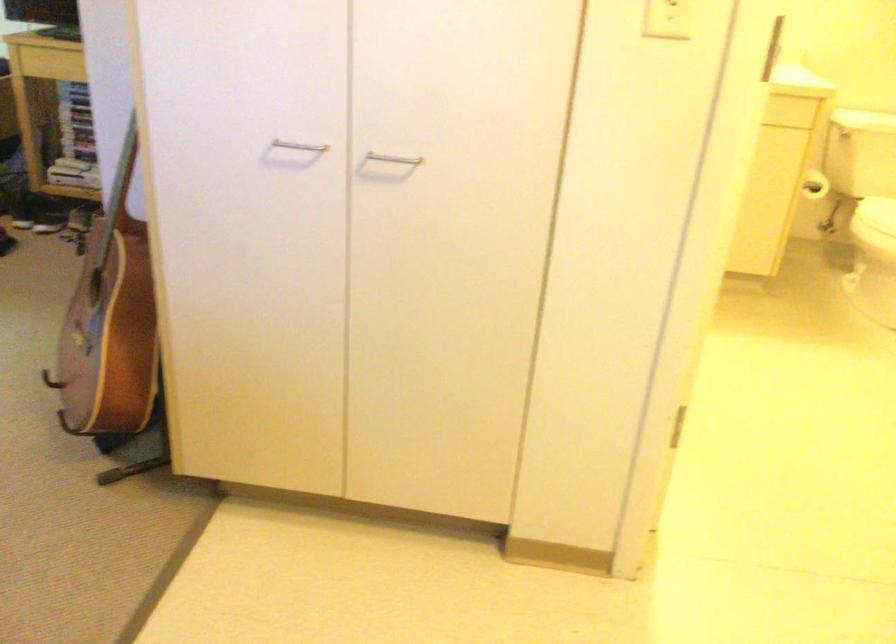
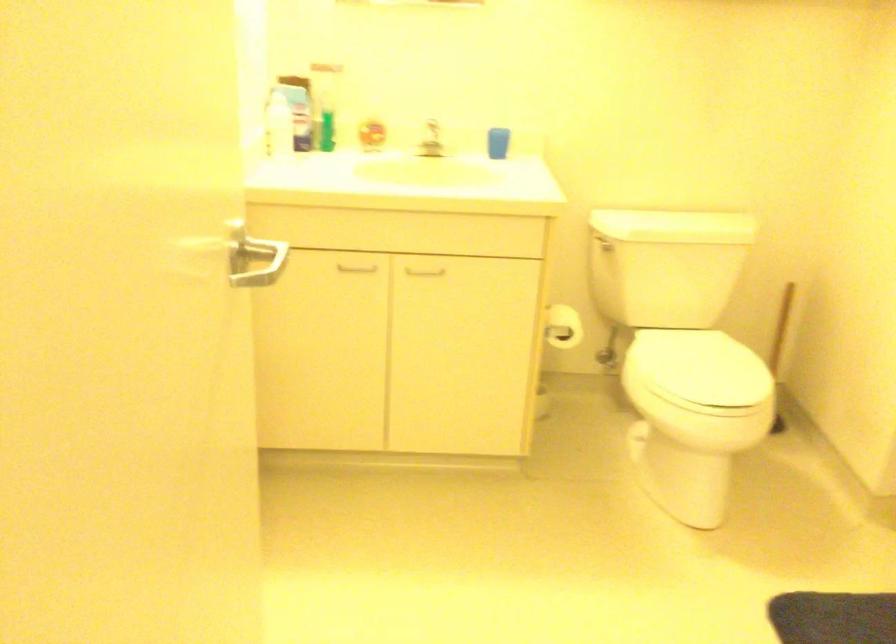
Question: I am providing you with two images of the same scene from different viewpoints. After the viewpoint changes to image2, which objects are now occluded?

Choices:
 (A) wooden coaster holder
 (B) toilet paper roll
 (C) blue cup
 (D) toilet plunger handle

Answer: (B)